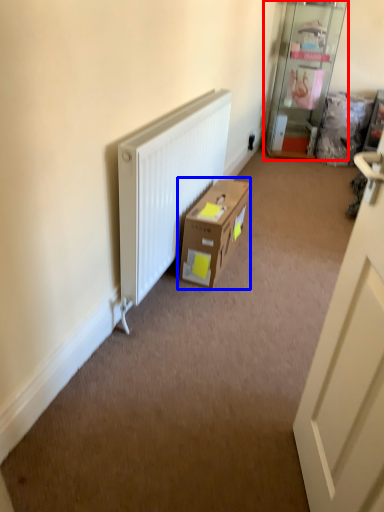
Question: Which point is closer to the camera, shelf (highlighted by a red box) or box (highlighted by a blue box)?

Choices:
 (A) shelf
 (B) box

Answer: (B)